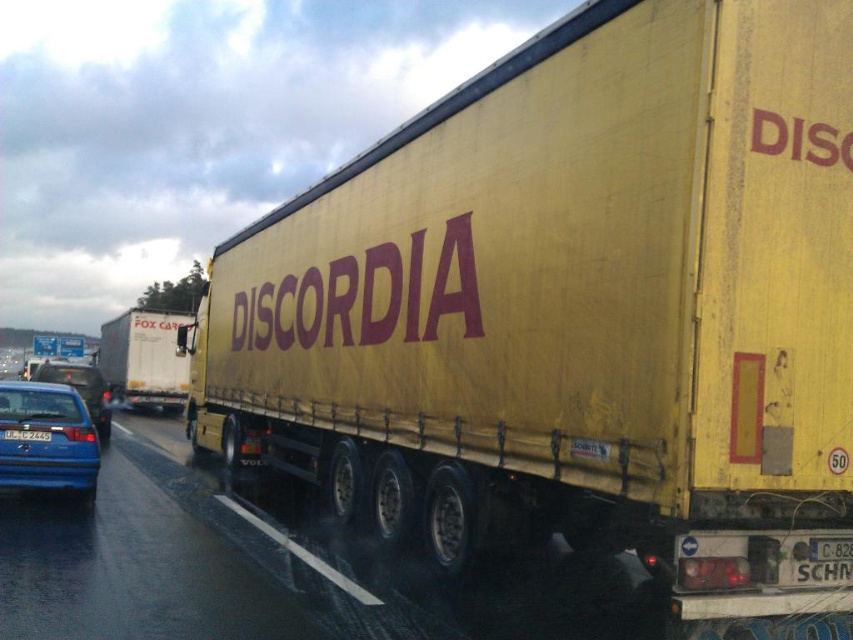
Can you confirm if matte blue sedan at left is positioned below white matte truck at left?

No.

Does matte blue sedan at left have a larger size compared to white matte truck at left?

No, matte blue sedan at left is not bigger than white matte truck at left.

Between point (25, 481) and point (111, 324), which one is positioned behind?

Positioned behind is point (111, 324).

The width and height of the screenshot is (853, 640). I want to click on matte blue sedan at left, so click(x=45, y=438).

Can you confirm if white matte truck at left is bigger than blue plastic license plate at center?

Indeed, white matte truck at left has a larger size compared to blue plastic license plate at center.

Does white matte truck at left appear on the right side of blue plastic license plate at center?

No, white matte truck at left is not to the right of blue plastic license plate at center.

Identify the location of white matte truck at left. The height and width of the screenshot is (640, 853). (144, 358).

Can you confirm if matte blue sedan at left is positioned to the left of blue plastic license plate at center?

Correct, you'll find matte blue sedan at left to the left of blue plastic license plate at center.

Consider the image. Can you confirm if matte blue sedan at left is positioned above blue plastic license plate at center?

No, matte blue sedan at left is not above blue plastic license plate at center.

Is point (3, 396) behind point (24, 436)?

Yes, point (3, 396) is farther from viewer.

Where is `matte blue sedan at left`? matte blue sedan at left is located at coordinates (45, 438).